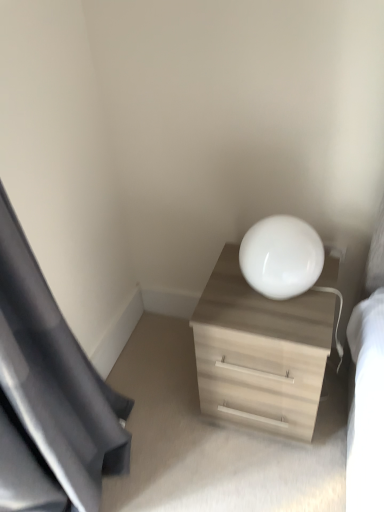
Question: Considering their positions, is light wood dresser at center located in front of or behind black fabric curtain at left?

Choices:
 (A) behind
 (B) front

Answer: (A)

Question: Visually, is light wood dresser at center positioned to the left or to the right of black fabric curtain at left?

Choices:
 (A) right
 (B) left

Answer: (A)

Question: Which of these objects is positioned closest to the black fabric curtain at left?

Choices:
 (A) white glossy lampshade at upper right
 (B) light wood dresser at center

Answer: (B)

Question: Considering the real-world distances, which object is farthest from the white glossy lampshade at upper right?

Choices:
 (A) black fabric curtain at left
 (B) light wood dresser at center

Answer: (A)